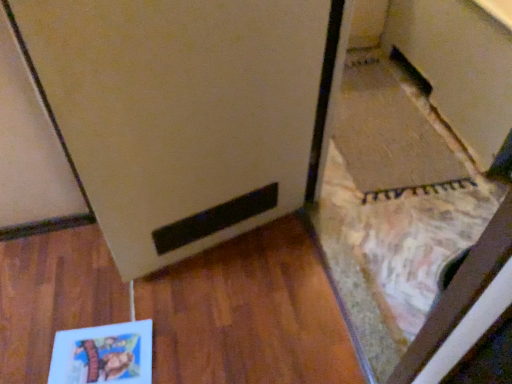
Find the location of a particular element. Image resolution: width=512 pixels, height=384 pixels. vacant space that is in between matte white fridge at center and matte paper book at lower left is located at coordinates (189, 286).